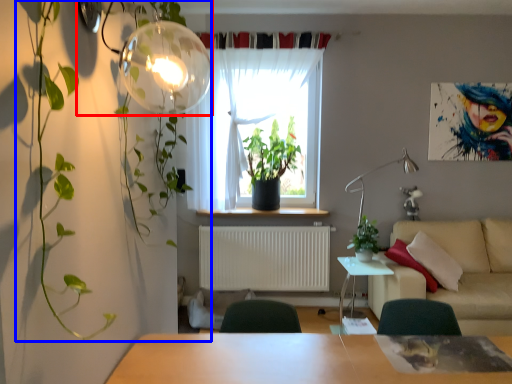
Question: Which object is further to the camera taking this photo, lamp (highlighted by a red box) or vegetation (highlighted by a blue box)?

Choices:
 (A) lamp
 (B) vegetation

Answer: (A)